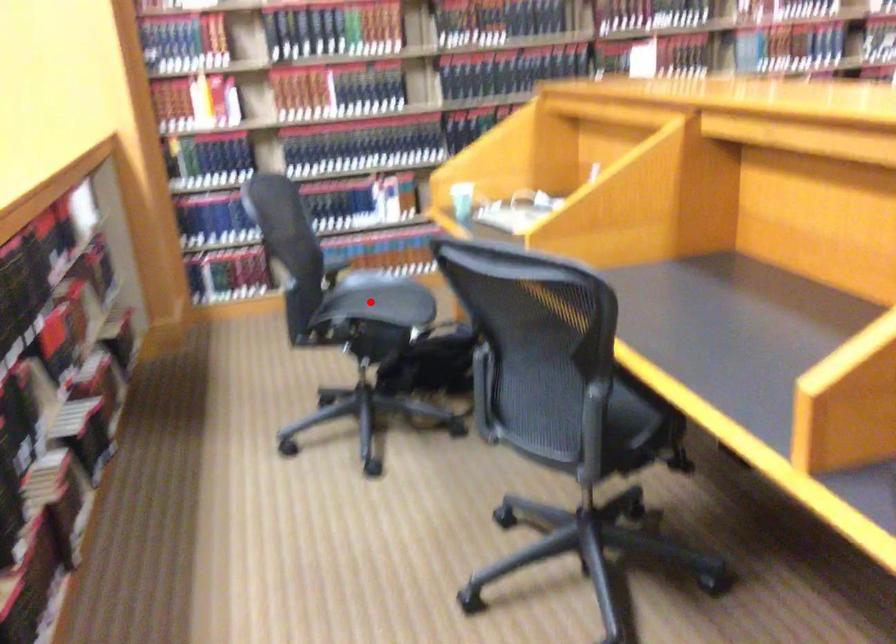
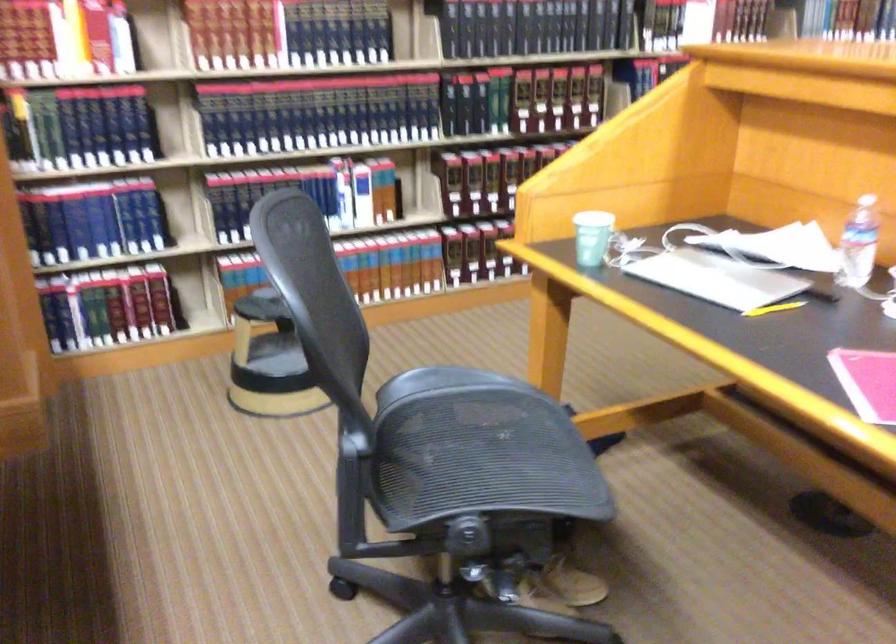
Question: I am providing you with two images of the same scene from different viewpoints. Given a red point in image1, look at the same physical point in image2. Is it:

Choices:
 (A) Closer to the viewpoint
 (B) Farther from the viewpoint

Answer: (A)